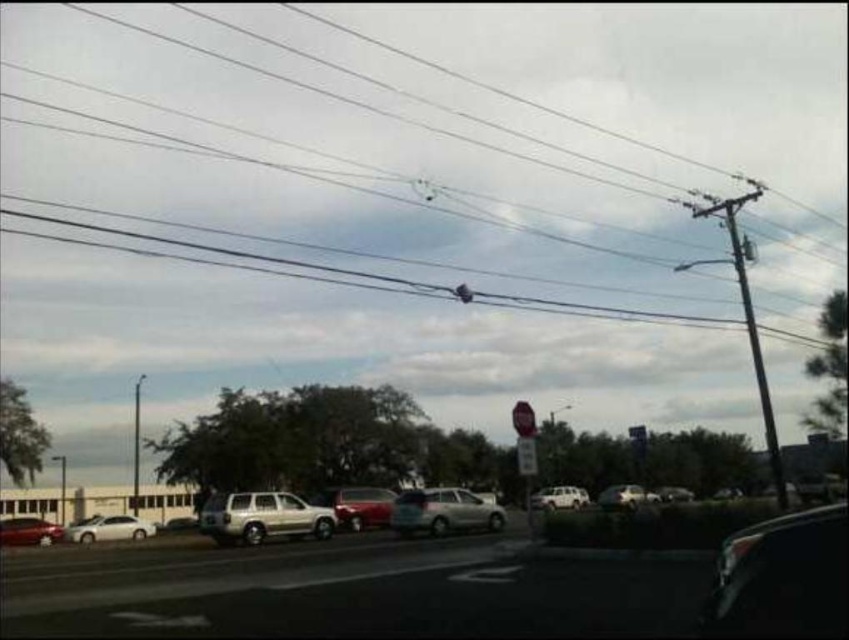
Does white matte suv at center appear on the left side of smooth gray pole at center?

No, white matte suv at center is not to the left of smooth gray pole at center.

Is white matte suv at center closer to camera compared to smooth gray pole at center?

Yes, it is in front of smooth gray pole at center.

Who is more distant from viewer, (582, 497) or (136, 472)?

The point (582, 497) is more distant.

This screenshot has height=640, width=849. Identify the location of white matte suv at center. (559, 497).

Between satin silver sedan at center and shiny silver sedan at lower right, which one is positioned lower?

shiny silver sedan at lower right is below.

I want to click on satin silver sedan at center, so click(443, 512).

This screenshot has width=849, height=640. I want to click on satin silver sedan at center, so click(x=443, y=512).

Is satin silver sedan at center in front of shiny red car at center?

Yes, satin silver sedan at center is in front of shiny red car at center.

Between satin silver sedan at center and shiny red car at center, which one appears on the right side from the viewer's perspective?

Positioned to the right is satin silver sedan at center.

Which is in front, point (481, 508) or point (360, 493)?

Point (481, 508) is in front.

Find the location of `satin silver sedan at center`. satin silver sedan at center is located at coordinates (443, 512).